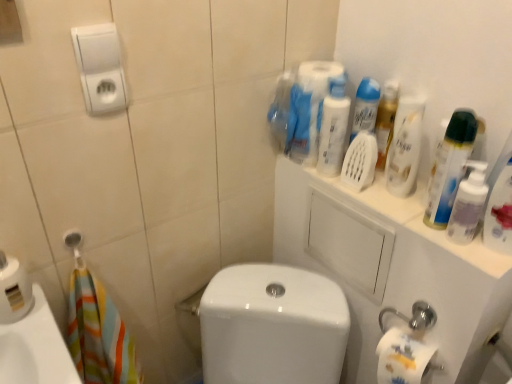
Where is `vacant area that is in front of white glossy shampoo at upper right, the 2th cleaning product positioned from the left`? This screenshot has height=384, width=512. vacant area that is in front of white glossy shampoo at upper right, the 2th cleaning product positioned from the left is located at coordinates (417, 223).